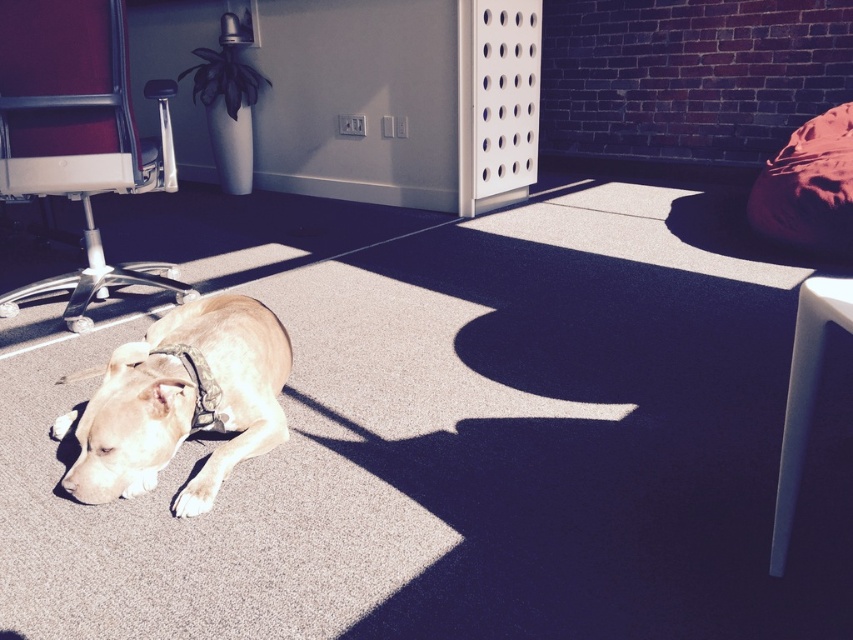
You are a dog owner who wants to place a new toy between the light brown fur at center and the black fabric neckband at lower left. The toy is 5 inches long. Can you fit it between them without overlapping either object?

The distance between the light brown fur at center and the black fabric neckband at lower left is 5.01 inches. Since the toy is 5 inches long, it can fit between them without overlapping either object.

In the scene shown: You are standing at the center of the room and want to move to the metallic silver office chair at left. Which direction should you walk to reach it?

You should walk to the left because the metallic silver office chair at left is located at point (78, 134), which is to the left of the center position.